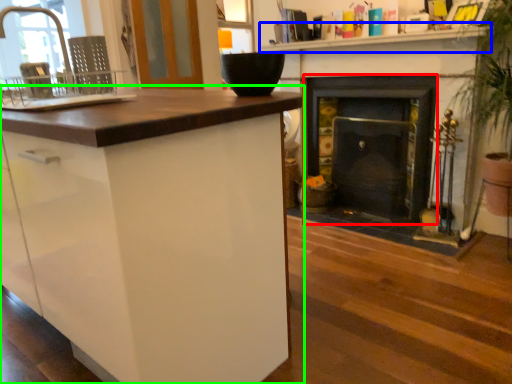
Question: Considering the real-world distances, which object is closest to fireplace (highlighted by a red box)? counter top (highlighted by a blue box) or cabinetry (highlighted by a green box).

Choices:
 (A) counter top
 (B) cabinetry

Answer: (A)